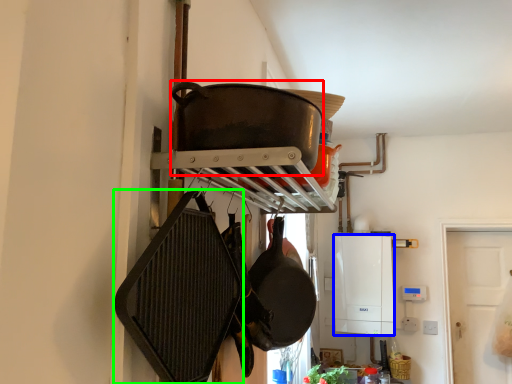
Question: Based on their relative distances, which object is nearer to wok (highlighted by a red box)? Choose from appliance (highlighted by a blue box) and frying pan (highlighted by a green box).

Choices:
 (A) appliance
 (B) frying pan

Answer: (B)